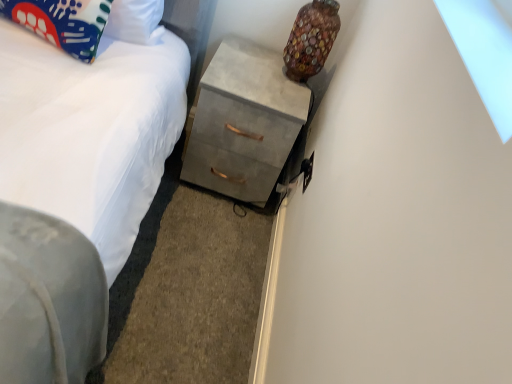
Question: Relative to matte fabric pillow at upper left, is multicolored glass vase at upper right in front or behind?

Choices:
 (A) front
 (B) behind

Answer: (B)

Question: Based on their positions, is multicolored glass vase at upper right located to the left or right of matte fabric pillow at upper left?

Choices:
 (A) right
 (B) left

Answer: (A)

Question: Estimate the real-world distances between objects in this image. Which object is farther from the concrete gray chest of drawers at center?

Choices:
 (A) white fabric bed at lower left
 (B) multicolored glass vase at upper right
 (C) matte fabric pillow at upper left

Answer: (C)

Question: Which object is positioned farthest from the multicolored glass vase at upper right?

Choices:
 (A) concrete gray chest of drawers at center
 (B) white fabric bed at lower left
 (C) matte fabric pillow at upper left

Answer: (C)